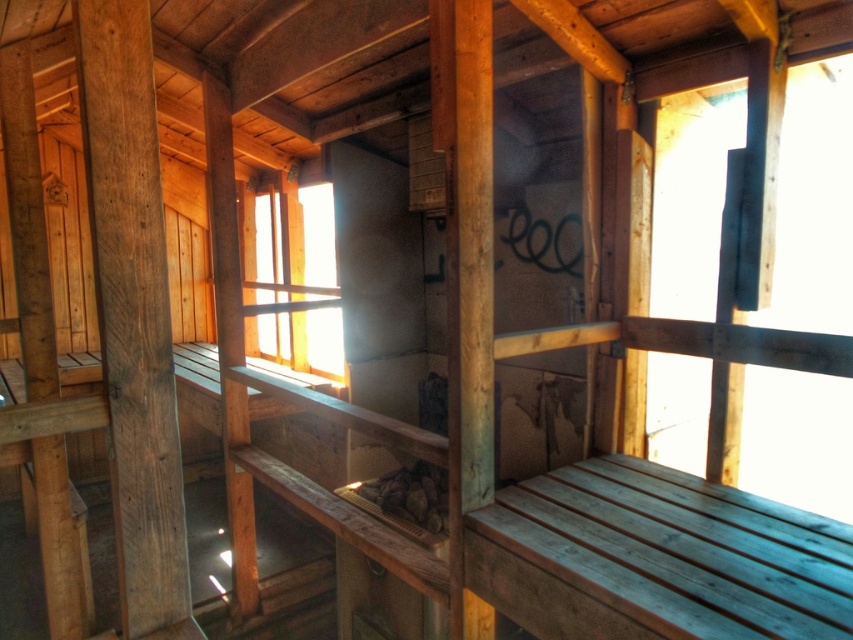
Question: Which object is closer to the camera taking this photo?

Choices:
 (A) transparent glass window at upper right
 (B) transparent glass window at center
 (C) smooth brown wood beam at left

Answer: (C)

Question: Does transparent glass window at upper right have a smaller size compared to smooth brown wood beam at left?

Choices:
 (A) yes
 (B) no

Answer: (B)

Question: Does transparent glass window at upper right come behind smooth brown wood beam at left?

Choices:
 (A) yes
 (B) no

Answer: (A)

Question: Is the position of smooth brown wood beam at left less distant than that of transparent glass window at center?

Choices:
 (A) no
 (B) yes

Answer: (B)

Question: Which is farther from the smooth brown wood beam at left?

Choices:
 (A) transparent glass window at upper right
 (B) transparent glass window at center

Answer: (B)

Question: Which point is farther to the camera?

Choices:
 (A) (265, 246)
 (B) (793, 440)

Answer: (A)